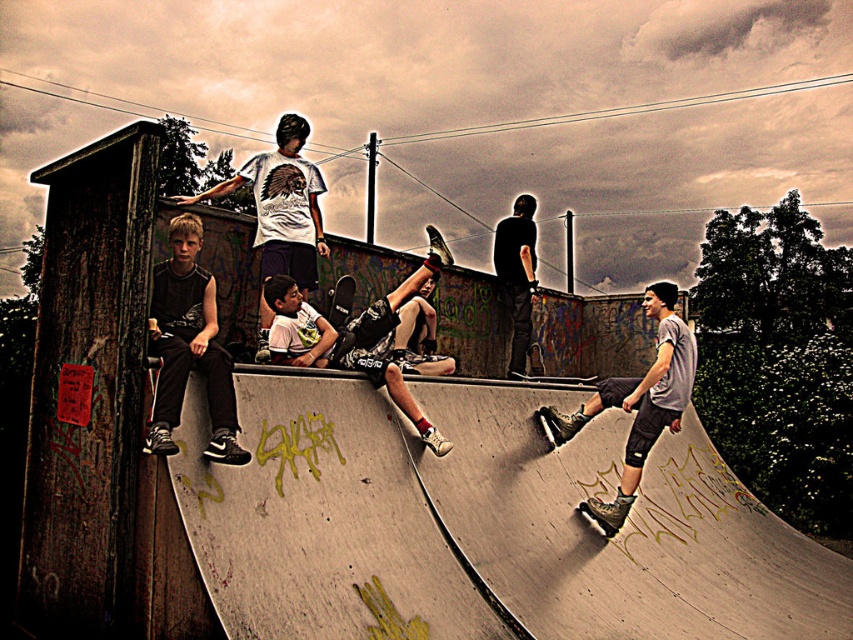
Can you confirm if black matte pants at left is positioned to the right of dark gray pants at center?

No, black matte pants at left is not to the right of dark gray pants at center.

Looking at this image, does black matte pants at left appear on the left side of dark gray pants at center?

Yes, black matte pants at left is to the left of dark gray pants at center.

Is point (175, 374) less distant than point (502, 228)?

Yes, it is.

You are a GUI agent. You are given a task and a screenshot of the screen. Output one action in this format:
    pyautogui.click(x=<x>, y=<y>)
    Task: Click on the black matte pants at left
    
    Given the screenshot: What is the action you would take?
    pyautogui.click(x=189, y=346)

Is black matte pants at left further to camera compared to white matte t-shirt at upper center?

No, it is in front of white matte t-shirt at upper center.

Can you confirm if black matte pants at left is thinner than white matte t-shirt at upper center?

Correct, black matte pants at left's width is less than white matte t-shirt at upper center's.

Between point (189, 252) and point (250, 180), which one is positioned behind?

The point (250, 180) is more distant.

I want to click on black matte pants at left, so click(189, 346).

Who is lower down, matte gray shorts at center or dark gray pants at center?

matte gray shorts at center is lower down.

Does matte gray shorts at center have a smaller size compared to dark gray pants at center?

Incorrect, matte gray shorts at center is not smaller in size than dark gray pants at center.

Is point (622, 486) positioned before point (517, 314)?

That is True.

At what (x,y) coordinates should I click in order to perform the action: click on matte gray shorts at center. Please return your answer as a coordinate pair (x, y). Looking at the image, I should click on (637, 403).